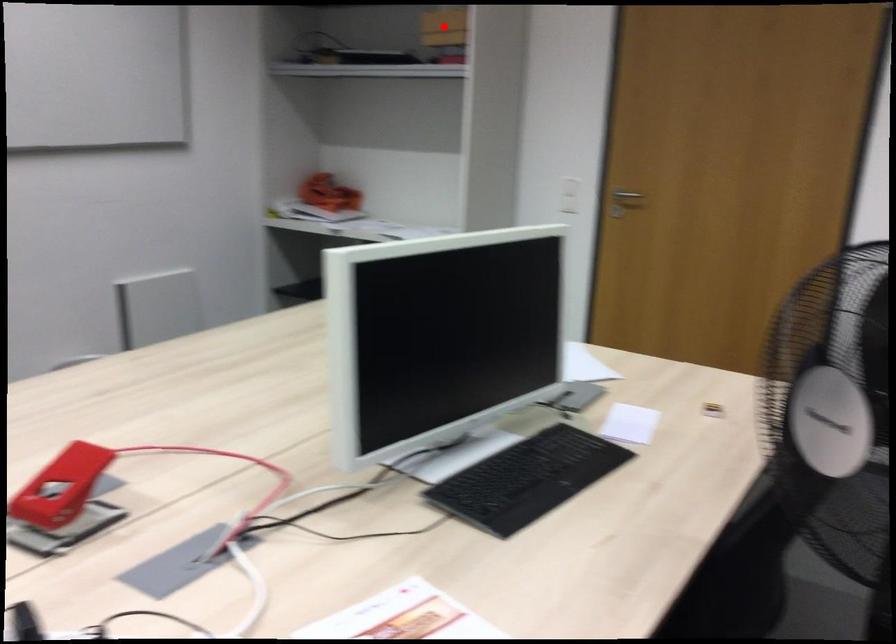
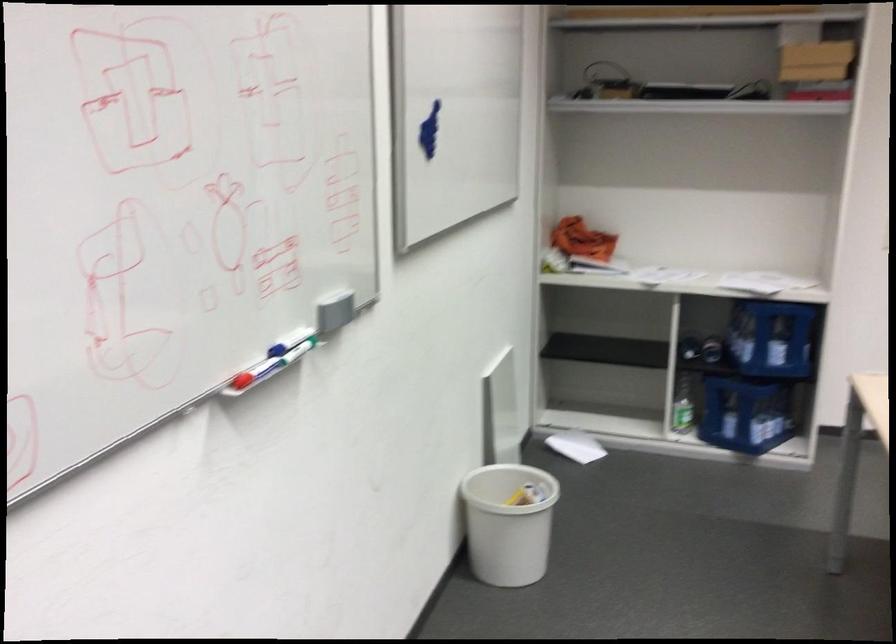
Question: I am providing you with two images of the same scene from different viewpoints. A red point is marked on the first image. Can you still see the location of the red point in image 2?

Choices:
 (A) Yes
 (B) No

Answer: (B)